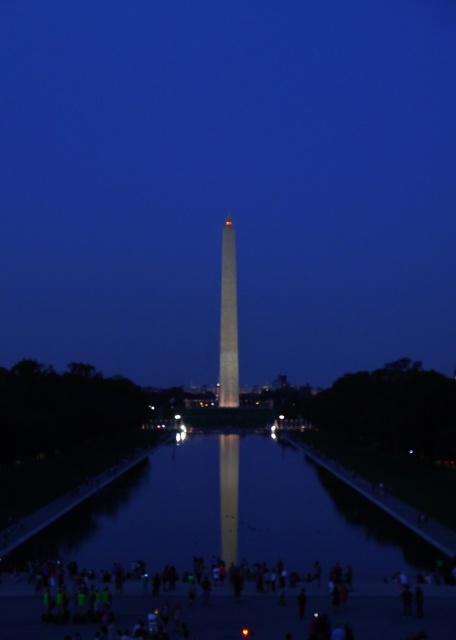
You are standing at the edge of the Reflecting Pool and see the dark clothing figure at center and the shiny gold obelisk at center. Which object appears taller from your viewpoint?

The shiny gold obelisk at center appears taller than the dark clothing figure at center because the dark clothing figure at center has a lesser height compared to the shiny gold obelisk at center.

You are standing at the edge of the Reflecting Pool and want to take a photo of the shiny gold obelisk at center with the glossy reflective water at center in the foreground. Since your camera has a 50 meter range, will you be able to capture both objects in one shot?

The glossy reflective water at center is 63.15 meters away from the shiny gold obelisk at center. Since the distance between them exceeds the camera range of 50 meters, you won wait be able to capture both objects in one shot.

You are standing at the Reflecting Pool and want to take a photo of both point (336, 497) and point (367, 593). Which point is closer to you so that you can frame both in your camera?

Point (336, 497) is closer to you than point (367, 593), so you can frame both points in your camera by focusing on the closer point first.